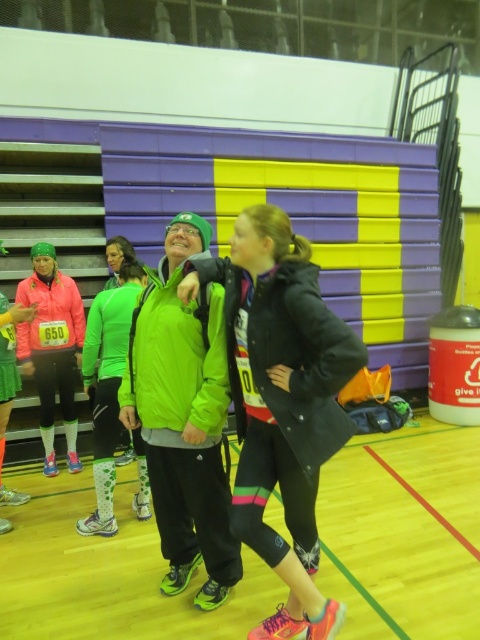
Question: Is matte black jacket at center further to camera compared to matte pink jacket at center?

Choices:
 (A) yes
 (B) no

Answer: (B)

Question: Which of these objects is positioned closest to the shiny black shoes at center?

Choices:
 (A) matte black jacket at center
 (B) matte pink jacket at center

Answer: (A)

Question: Does shiny black shoes at center appear over matte black jacket at center?

Choices:
 (A) no
 (B) yes

Answer: (A)

Question: Is shiny black shoes at center smaller than matte black jacket at center?

Choices:
 (A) yes
 (B) no

Answer: (B)

Question: Which point is farther from the camera taking this photo?

Choices:
 (A) [x=215, y=273]
 (B) [x=26, y=285]
 (C) [x=442, y=540]

Answer: (B)

Question: Which object is closer to the camera taking this photo?

Choices:
 (A) matte black jacket at center
 (B) shiny black shoes at center
 (C) matte pink jacket at center

Answer: (A)